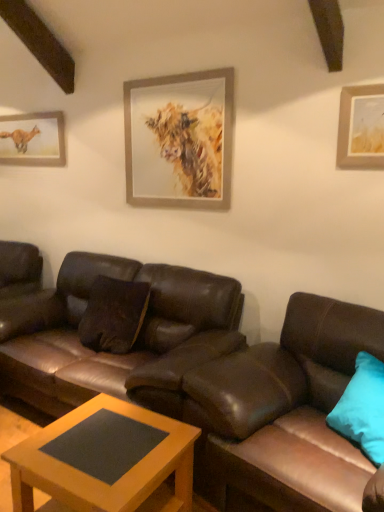
Locate an element on the screen. This screenshot has height=512, width=384. free point above wooden matte coffee table at center (from a real-world perspective) is located at coordinates click(100, 438).